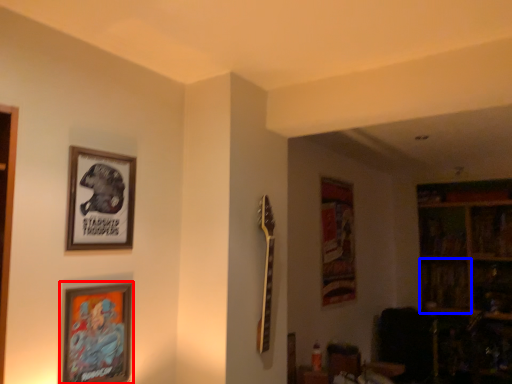
Question: Which object is closer to the camera taking this photo, picture frame (highlighted by a red box) or shelf (highlighted by a blue box)?

Choices:
 (A) picture frame
 (B) shelf

Answer: (A)